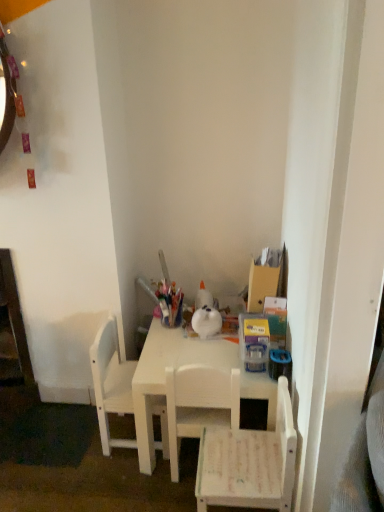
Question: From the image's perspective, is white matte chair at lower right, which appears as the first chair when viewed from the right, below white matte chair at center, which ranks as the 2th chair in right-to-left order?

Choices:
 (A) no
 (B) yes

Answer: (B)

Question: Is white matte chair at lower right, which appears as the first chair when viewed from the right, facing away from white matte chair at center, which ranks as the 2th chair in right-to-left order?

Choices:
 (A) no
 (B) yes

Answer: (A)

Question: Is white matte chair at lower right, which appears as the first chair when viewed from the right, aimed at white matte chair at center, which ranks as the 2th chair in right-to-left order?

Choices:
 (A) no
 (B) yes

Answer: (A)

Question: Is white matte chair at lower right, which ranks as the third chair in left-to-right order, thinner than white matte chair at center, which ranks as the 2th chair in right-to-left order?

Choices:
 (A) no
 (B) yes

Answer: (A)

Question: Is white matte chair at lower right, which ranks as the third chair in left-to-right order, positioned before white matte chair at center, which ranks as the 2th chair in right-to-left order?

Choices:
 (A) no
 (B) yes

Answer: (B)

Question: From a real-world perspective, is white matte chair at lower right, which appears as the first chair when viewed from the right, physically above white matte chair at center, marked as the 2th chair in a left-to-right arrangement?

Choices:
 (A) yes
 (B) no

Answer: (B)

Question: Is white matte chair at left, the first chair positioned from the left, aimed at white matte table at center?

Choices:
 (A) no
 (B) yes

Answer: (B)

Question: Is white matte chair at left, the first chair positioned from the left, looking in the opposite direction of white matte table at center?

Choices:
 (A) yes
 (B) no

Answer: (B)

Question: From a real-world perspective, is white matte chair at left, which ranks as the 3th chair in right-to-left order, beneath white matte table at center?

Choices:
 (A) no
 (B) yes

Answer: (A)

Question: From the image's perspective, is white matte chair at left, the first chair positioned from the left, located beneath white matte table at center?

Choices:
 (A) no
 (B) yes

Answer: (A)

Question: Considering the relative positions of white matte chair at left, which ranks as the 3th chair in right-to-left order, and white matte table at center in the image provided, is white matte chair at left, which ranks as the 3th chair in right-to-left order, to the left of white matte table at center from the viewer's perspective?

Choices:
 (A) no
 (B) yes

Answer: (B)

Question: Does white matte chair at left, the first chair positioned from the left, have a lesser width compared to white matte table at center?

Choices:
 (A) yes
 (B) no

Answer: (A)

Question: Is white matte chair at lower right, which ranks as the third chair in left-to-right order, surrounded by white matte chair at left, the first chair positioned from the left?

Choices:
 (A) no
 (B) yes

Answer: (A)